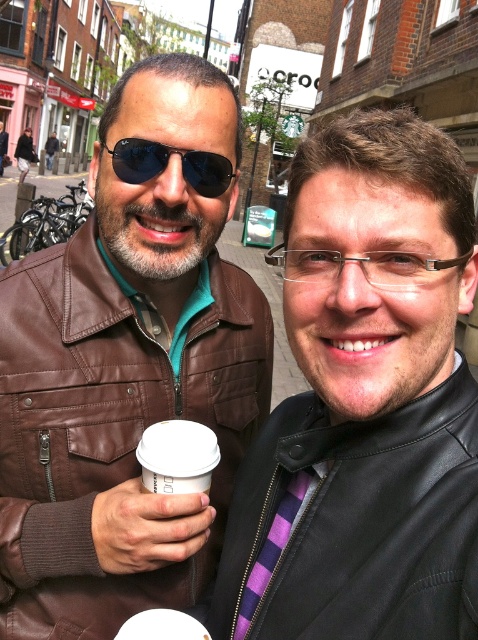
You are a fashion designer analyzing the image. You notice the purple striped tie at center and the matte black sunglasses at upper left. Which of these two items has a bigger size?

The purple striped tie at center has a larger size compared to the matte black sunglasses at upper left.